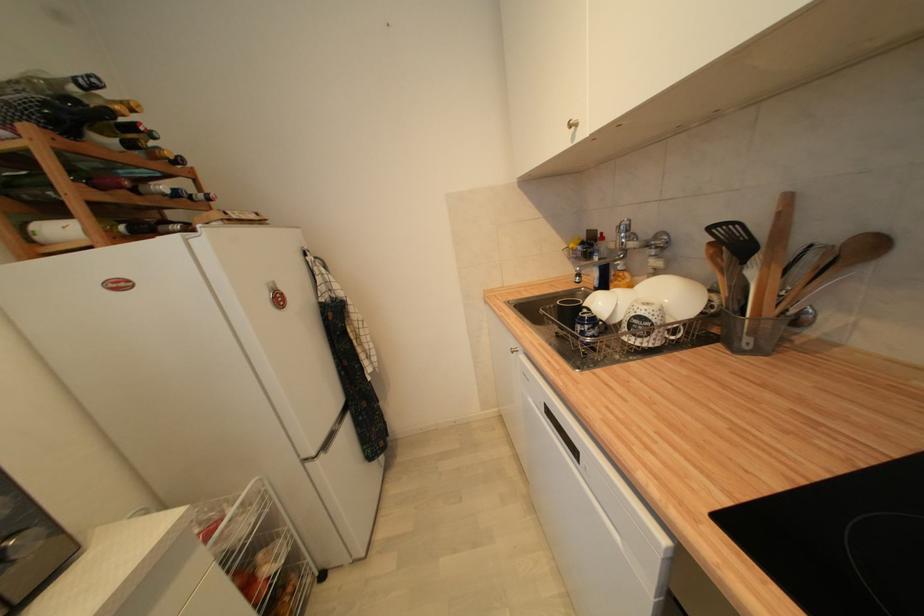
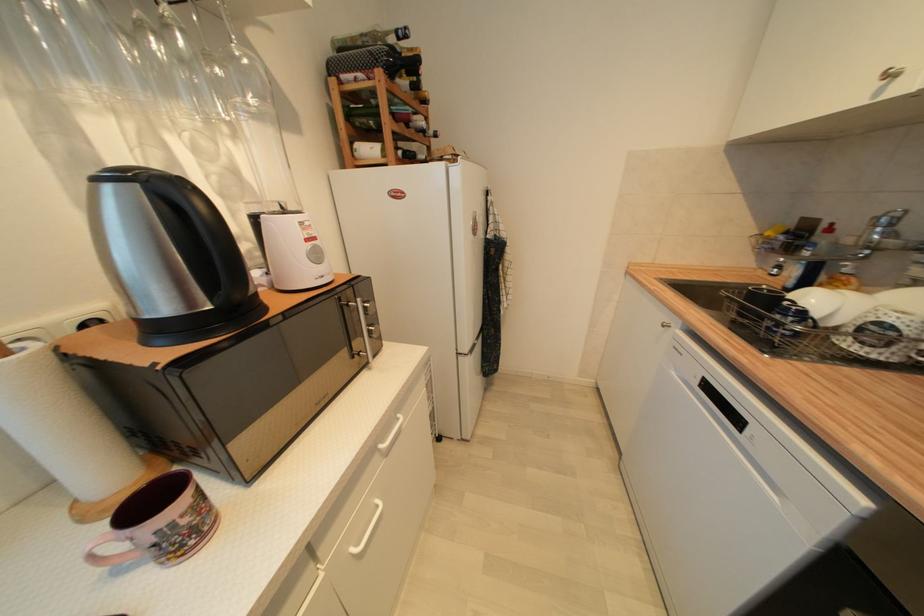
In a continuous first-person perspective shot, in which direction is the camera moving?

The cameraman walked toward left, backward.